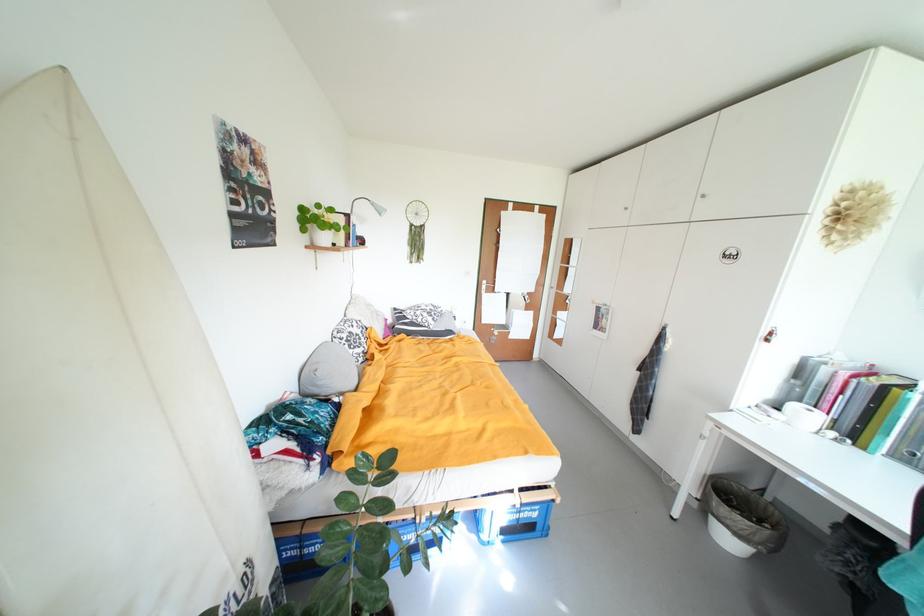
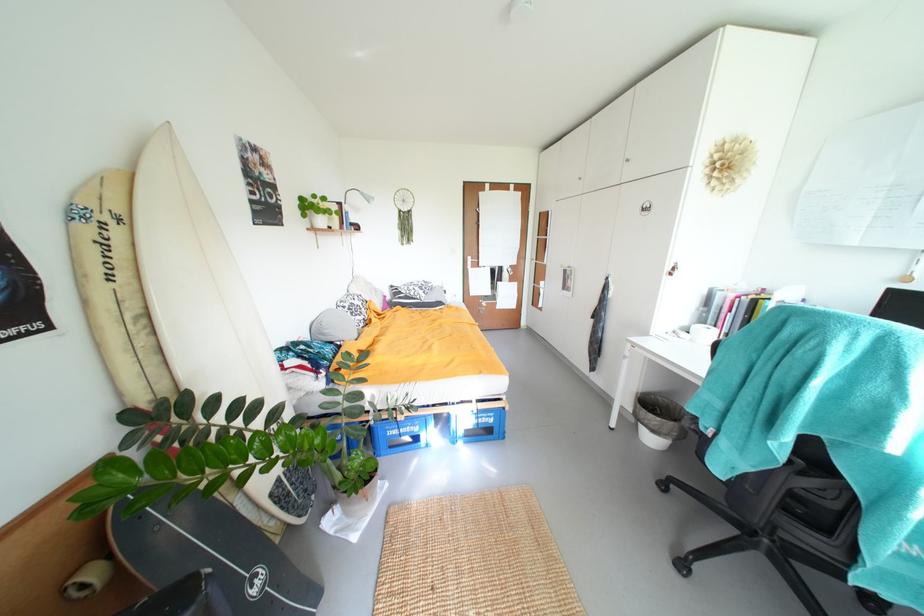
In the second image, find the point that corresponds to (326,385) in the first image.

(333, 333)